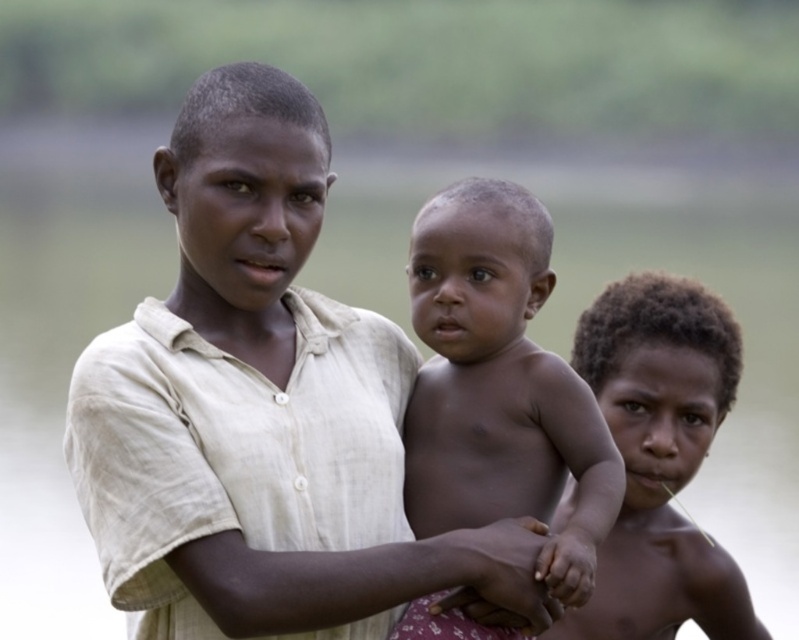
Between point (698, 620) and point (495, 596), which one is positioned behind?

Positioned behind is point (698, 620).

Does dark brown skin at center appear over smooth skin hand at center?

Yes, dark brown skin at center is above smooth skin hand at center.

Is point (722, 406) less distant than point (501, 557)?

No, (722, 406) is behind (501, 557).

Where is `dark brown skin at center`? This screenshot has width=799, height=640. dark brown skin at center is located at coordinates (658, 458).

Does smooth skin baby at center lie in front of dark brown skin at center?

Yes, it is.

Which is more to the left, smooth skin baby at center or dark brown skin at center?

smooth skin baby at center

What do you see at coordinates (499, 387) in the screenshot? Image resolution: width=799 pixels, height=640 pixels. I see `smooth skin baby at center` at bounding box center [499, 387].

This screenshot has width=799, height=640. Find the location of `smooth skin baby at center`. smooth skin baby at center is located at coordinates (499, 387).

Between point (495, 348) and point (535, 538), which one is positioned behind?

The point (495, 348) is more distant.

Who is more forward, (431,268) or (527,515)?

Point (431,268)

The width and height of the screenshot is (799, 640). What do you see at coordinates (499, 387) in the screenshot?
I see `smooth skin baby at center` at bounding box center [499, 387].

Identify the location of smooth skin baby at center. The image size is (799, 640). (499, 387).